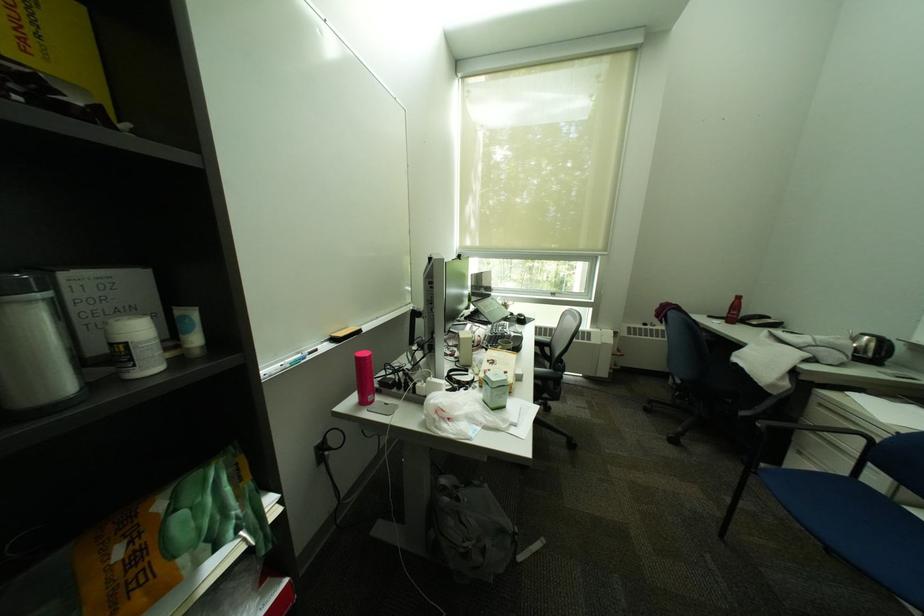
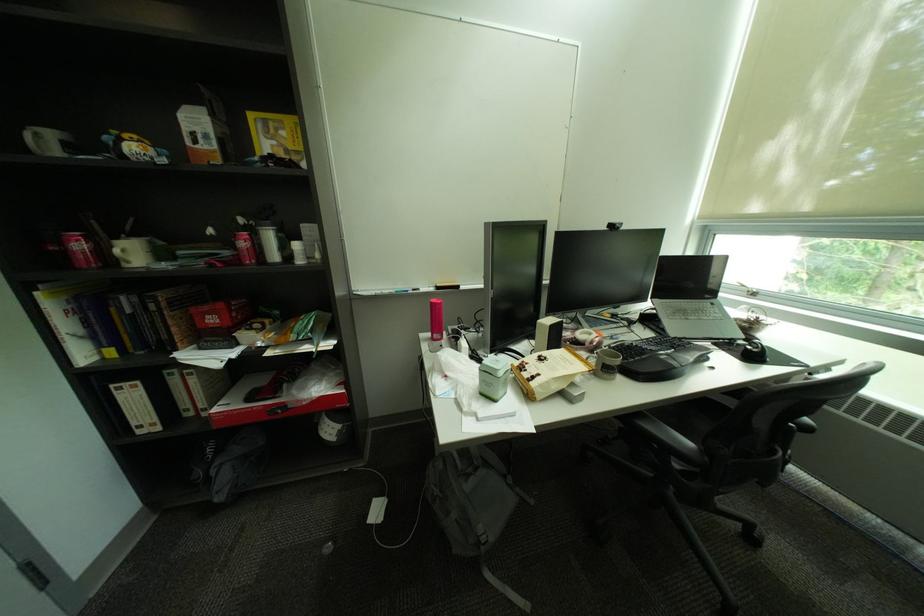
In the second image, find the point that corresponds to [533,318] in the first image.

(766, 352)